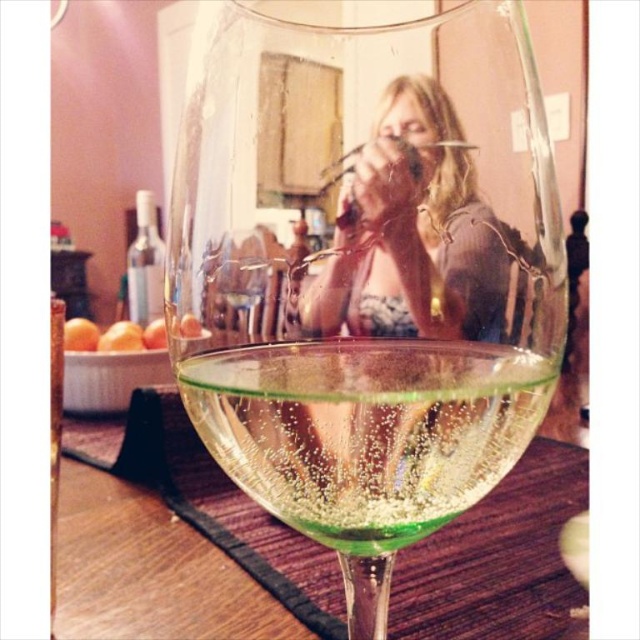
Question: Is green glass wine at center below translucent glass at center?

Choices:
 (A) yes
 (B) no

Answer: (A)

Question: Which of the following is the closest to the observer?

Choices:
 (A) (234, 516)
 (B) (536, 296)
 (C) (467, 314)
 (D) (545, 360)

Answer: (C)

Question: Is green translucent wine glass at center smaller than green glass wine at center?

Choices:
 (A) no
 (B) yes

Answer: (A)

Question: Among these points, which one is farthest from the camera?

Choices:
 (A) (273, 401)
 (B) (93, 426)

Answer: (B)

Question: Does translucent glass table at center have a larger size compared to translucent glass at center?

Choices:
 (A) no
 (B) yes

Answer: (B)

Question: Which point is farther to the camera?

Choices:
 (A) translucent glass at center
 (B) green glass wine at center

Answer: (A)